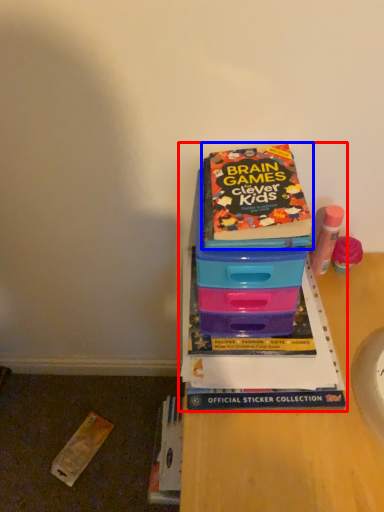
Question: Among these objects, which one is nearest to the camera, book (highlighted by a red box) or book (highlighted by a blue box)?

Choices:
 (A) book
 (B) book

Answer: (B)